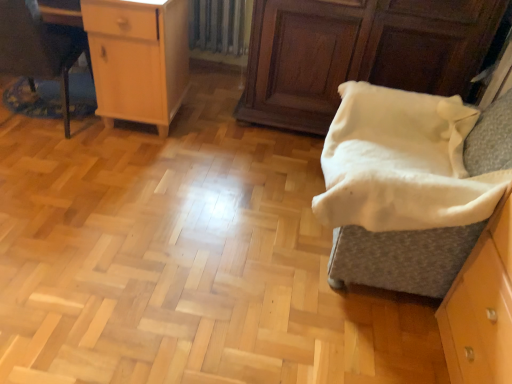
Where is `free spot in front of brushed metal desk at left`? free spot in front of brushed metal desk at left is located at coordinates (42, 166).